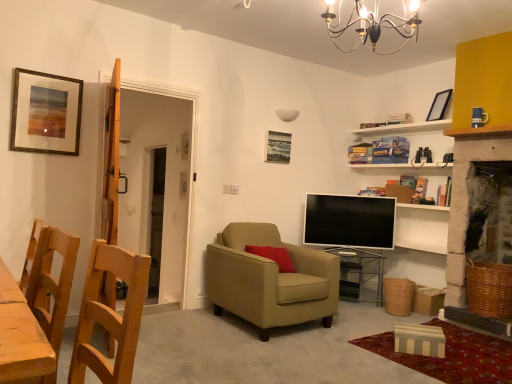
What do you see at coordinates (350, 221) in the screenshot? This screenshot has width=512, height=384. I see `matte black screen at center` at bounding box center [350, 221].

Where is `matte wooden picture frame at upper center, which is the 2th picture frame in right-to-left order`? matte wooden picture frame at upper center, which is the 2th picture frame in right-to-left order is located at coordinates (278, 147).

The width and height of the screenshot is (512, 384). Find the location of `beige fabric armchair at center, which appears as the first chair when viewed from the back`. beige fabric armchair at center, which appears as the first chair when viewed from the back is located at coordinates (270, 280).

Does beige fabric armchair at center, which is the 3th chair from front to back, appear on the right side of matte black picture frame at upper right, positioned as the 3th picture frame in left-to-right order?

In fact, beige fabric armchair at center, which is the 3th chair from front to back, is to the left of matte black picture frame at upper right, positioned as the 3th picture frame in left-to-right order.

Which object is wider, beige fabric armchair at center, which is the 3th chair from front to back, or matte black picture frame at upper right, which ranks as the second picture frame in back-to-front order?

Wider between the two is beige fabric armchair at center, which is the 3th chair from front to back.

Locate an element on the screen. The image size is (512, 384). the 1st picture frame behind the beige fabric armchair at center, which is the 3th chair from front to back, starting your count from the anchor is located at coordinates (439, 105).

From their relative heights in the image, would you say beige fabric armchair at center, which appears as the first chair when viewed from the back, is taller or shorter than matte black picture frame at upper right, the second picture frame when ordered from front to back?

beige fabric armchair at center, which appears as the first chair when viewed from the back, is taller than matte black picture frame at upper right, the second picture frame when ordered from front to back.

Measure the distance between matte black screen at center and matte black picture frame at upper right, positioned as the 3th picture frame in left-to-right order.

They are 4.23 feet apart.

From the image's perspective, does matte black screen at center appear higher than matte black picture frame at upper right, which ranks as the second picture frame in back-to-front order?

No, from the image's perspective, matte black screen at center is not above matte black picture frame at upper right, which ranks as the second picture frame in back-to-front order.

Is matte black screen at center closer to camera compared to matte black picture frame at upper right, the second picture frame when ordered from front to back?

No.

Is matte black screen at center oriented towards matte black picture frame at upper right, arranged as the 1th picture frame when viewed from the right?

No.

Who is shorter, wooden chair at left, placed as the 1th chair when sorted from front to back, or metallic chandelier at upper center?

metallic chandelier at upper center.

Is wooden chair at left, which appears as the 3th chair when viewed from the back, to the left of metallic chandelier at upper center from the viewer's perspective?

Yes.

The height and width of the screenshot is (384, 512). I want to click on the 2nd chair counting from the left side of the metallic chandelier at upper center, so click(x=110, y=315).

Is wooden chair at left, which appears as the 3th chair when viewed from the back, further to camera compared to metallic chandelier at upper center?

No, the depth of wooden chair at left, which appears as the 3th chair when viewed from the back, is less than that of metallic chandelier at upper center.

Considering the positions of points (284, 162) and (225, 278), is point (284, 162) farther from camera compared to point (225, 278)?

Yes, point (284, 162) is farther from viewer.

Is matte wooden picture frame at upper center, positioned as the 3th picture frame in front-to-back order, positioned with its back to beige fabric armchair at center, which appears as the first chair when viewed from the back?

matte wooden picture frame at upper center, positioned as the 3th picture frame in front-to-back order, is not turned away from beige fabric armchair at center, which appears as the first chair when viewed from the back.

Looking at this image, is matte wooden picture frame at upper center, positioned as the 3th picture frame in front-to-back order, positioned behind beige fabric armchair at center, which appears as the first chair when viewed from the back?

Yes, matte wooden picture frame at upper center, positioned as the 3th picture frame in front-to-back order, is behind beige fabric armchair at center, which appears as the first chair when viewed from the back.

Find the location of `light fixture in front of the gold-framed painting at upper left, the third picture frame from the right`. light fixture in front of the gold-framed painting at upper left, the third picture frame from the right is located at coordinates (373, 23).

From the image's perspective, between gold-framed painting at upper left, acting as the 1th picture frame starting from the left, and metallic chandelier at upper center, who is located below?

gold-framed painting at upper left, acting as the 1th picture frame starting from the left, appears lower in the image.

From a real-world perspective, does gold-framed painting at upper left, acting as the 1th picture frame starting from the left, stand above metallic chandelier at upper center?

No, from a real-world perspective, gold-framed painting at upper left, acting as the 1th picture frame starting from the left, is not above metallic chandelier at upper center.

Are gold-framed painting at upper left, which ranks as the first picture frame in front-to-back order, and metallic chandelier at upper center far apart?

Indeed, gold-framed painting at upper left, which ranks as the first picture frame in front-to-back order, is not near metallic chandelier at upper center.

Is matte wooden picture frame at upper center, positioned as the 3th picture frame in front-to-back order, located outside matte black picture frame at upper right, which ranks as the second picture frame in back-to-front order?

Yes.

Can you confirm if matte wooden picture frame at upper center, which is the 2th picture frame in right-to-left order, is bigger than matte black picture frame at upper right, arranged as the 1th picture frame when viewed from the right?

Actually, matte wooden picture frame at upper center, which is the 2th picture frame in right-to-left order, might be smaller than matte black picture frame at upper right, arranged as the 1th picture frame when viewed from the right.

From the image's perspective, is matte wooden picture frame at upper center, the 2th picture frame from the left, positioned above or below matte black picture frame at upper right, which ranks as the second picture frame in back-to-front order?

matte wooden picture frame at upper center, the 2th picture frame from the left, is situated lower than matte black picture frame at upper right, which ranks as the second picture frame in back-to-front order, in the image.

Between matte wooden picture frame at upper center, positioned as the 3th picture frame in front-to-back order, and matte black picture frame at upper right, positioned as the 3th picture frame in left-to-right order, which one has less height?

matte black picture frame at upper right, positioned as the 3th picture frame in left-to-right order.

Is the position of matte black screen at center less distant than that of beige fabric armchair at center, which is the 3th chair from front to back?

No.

From the picture: Is matte black screen at center not within beige fabric armchair at center, which appears as the first chair when viewed from the back?

Indeed, matte black screen at center is completely outside beige fabric armchair at center, which appears as the first chair when viewed from the back.

Is matte black screen at center shorter than beige fabric armchair at center, which appears as the first chair when viewed from the back?

Yes, matte black screen at center is shorter than beige fabric armchair at center, which appears as the first chair when viewed from the back.

Is matte black screen at center next to beige fabric armchair at center, which is the 3th chair from front to back, and touching it?

No, matte black screen at center is not making contact with beige fabric armchair at center, which is the 3th chair from front to back.

From a real-world perspective, starting from the beige fabric armchair at center, which is the 3th chair from front to back, which picture frame is the 3rd one vertically above it? Please provide its 2D coordinates.

[(439, 105)]

Image resolution: width=512 pixels, height=384 pixels. Identify the location of television behind the matte black picture frame at upper right, which ranks as the second picture frame in back-to-front order. (350, 221).

Which object lies further to the anchor point gold-framed painting at upper left, which ranks as the first picture frame in front-to-back order, matte black screen at center or matte black picture frame at upper right, the second picture frame when ordered from front to back?

matte black picture frame at upper right, the second picture frame when ordered from front to back, is further to gold-framed painting at upper left, which ranks as the first picture frame in front-to-back order.

Which object lies further to the anchor point matte black picture frame at upper right, which ranks as the second picture frame in back-to-front order, wooden chair at left, which appears as the 3th chair when viewed from the back, or transparent glass table at center?

wooden chair at left, which appears as the 3th chair when viewed from the back, is positioned further to the anchor matte black picture frame at upper right, which ranks as the second picture frame in back-to-front order.

Looking at the image, which one is located further to matte black picture frame at upper right, positioned as the 3th picture frame in left-to-right order, matte black screen at center or gold-framed painting at upper left, which ranks as the first picture frame in front-to-back order?

Among the two, gold-framed painting at upper left, which ranks as the first picture frame in front-to-back order, is located further to matte black picture frame at upper right, positioned as the 3th picture frame in left-to-right order.

Based on their spatial positions, is matte wooden picture frame at upper center, the 1th picture frame positioned from the back, or gold-framed painting at upper left, which ranks as the first picture frame in front-to-back order, further from light brown wooden chair at left, acting as the 2th chair starting from the front?

Among the two, matte wooden picture frame at upper center, the 1th picture frame positioned from the back, is located further to light brown wooden chair at left, acting as the 2th chair starting from the front.

Estimate the real-world distances between objects in this image. Which object is further from matte black screen at center, metallic chandelier at upper center or matte wooden picture frame at upper center, the 1th picture frame positioned from the back?

metallic chandelier at upper center is positioned further to the anchor matte black screen at center.

Looking at the image, which one is located closer to matte wooden picture frame at upper center, the 1th picture frame positioned from the back, matte black picture frame at upper right, positioned as the 3th picture frame in left-to-right order, or metallic chandelier at upper center?

Based on the image, matte black picture frame at upper right, positioned as the 3th picture frame in left-to-right order, appears to be nearer to matte wooden picture frame at upper center, the 1th picture frame positioned from the back.

Based on their spatial positions, is gold-framed painting at upper left, the 3th picture frame positioned from the back, or matte wooden picture frame at upper center, positioned as the 3th picture frame in front-to-back order, further from light brown wooden chair at left, acting as the 2th chair starting from the front?

Among the two, matte wooden picture frame at upper center, positioned as the 3th picture frame in front-to-back order, is located further to light brown wooden chair at left, acting as the 2th chair starting from the front.

Based on their spatial positions, is gold-framed painting at upper left, the third picture frame from the right, or metallic chandelier at upper center closer to matte black picture frame at upper right, which ranks as the second picture frame in back-to-front order?

Based on the image, metallic chandelier at upper center appears to be nearer to matte black picture frame at upper right, which ranks as the second picture frame in back-to-front order.

This screenshot has height=384, width=512. I want to click on chair between light brown wooden chair at left, acting as the 2th chair starting from the front, and matte wooden picture frame at upper center, the 2th picture frame from the left, along the z-axis, so click(270, 280).

The width and height of the screenshot is (512, 384). Identify the location of picture frame located between wooden chair at left, placed as the 1th chair when sorted from front to back, and beige fabric armchair at center, which appears as the first chair when viewed from the back, in the depth direction. (45, 113).

This screenshot has height=384, width=512. What are the coordinates of `picture frame between gold-framed painting at upper left, which ranks as the first picture frame in front-to-back order, and matte black picture frame at upper right, which ranks as the second picture frame in back-to-front order, from left to right` in the screenshot? It's located at (278, 147).

Where is `light fixture between light brown wooden chair at left, acting as the 2th chair starting from the front, and beige fabric armchair at center, which is the 3th chair from front to back, in the front-back direction`? light fixture between light brown wooden chair at left, acting as the 2th chair starting from the front, and beige fabric armchair at center, which is the 3th chair from front to back, in the front-back direction is located at coordinates (373, 23).